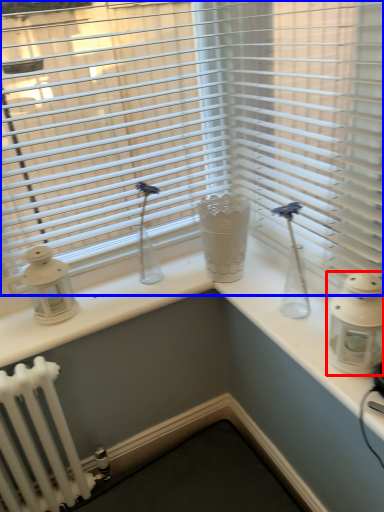
Question: Among these objects, which one is nearest to the camera, candle holder (highlighted by a red box) or window blind (highlighted by a blue box)?

Choices:
 (A) candle holder
 (B) window blind

Answer: (A)